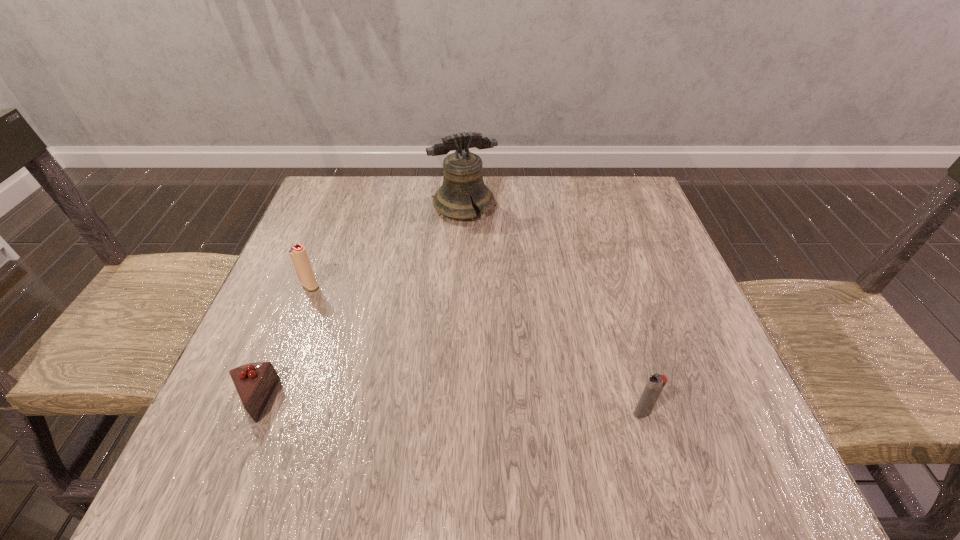
What are the coordinates of `vacant space that is in between the bell and the rightmost object` in the screenshot? It's located at (553, 309).

Locate which object is the third closest to the rightmost object. Please provide its 2D coordinates. Your answer should be formatted as a tuple, i.e. [(x, y)], where the tuple contains the x and y coordinates of a point satisfying the conditions above.

[(299, 256)]

I want to click on object that is the second closest one to the left igniter, so click(x=463, y=181).

The width and height of the screenshot is (960, 540). Identify the location of vacant point that satisfies the following two spatial constraints: 1. on the front side of the rightmost object; 2. on the right side of the bell. (455, 413).